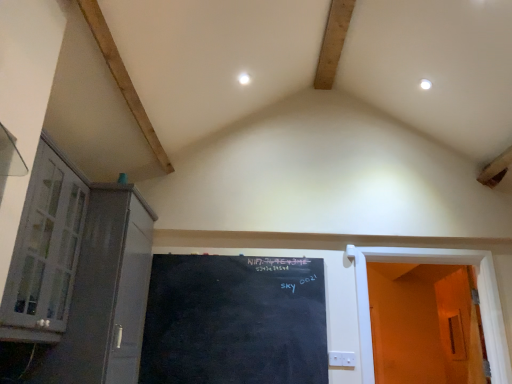
Question: Is white wooden door at right, the 2th door viewed from the right, inside or outside of white glass cabinet at left?

Choices:
 (A) inside
 (B) outside

Answer: (B)

Question: In terms of height, does white wooden door at right, which is counted as the 1th door, starting from the left, look taller or shorter compared to white glass cabinet at left?

Choices:
 (A) short
 (B) tall

Answer: (B)

Question: Considering the real-world distances, which object is closest to the matte gray cabinet at left?

Choices:
 (A) white glass cabinet at left
 (B) white wooden door at right, the 2th door viewed from the right
 (C) orange matte door at right, the second door from the left
 (D) black chalkboard at center

Answer: (A)

Question: Which object is positioned closest to the white wooden door at right, which is counted as the 1th door, starting from the left?

Choices:
 (A) matte gray cabinet at left
 (B) orange matte door at right, the 1th door viewed from the right
 (C) white glass cabinet at left
 (D) black chalkboard at center

Answer: (B)